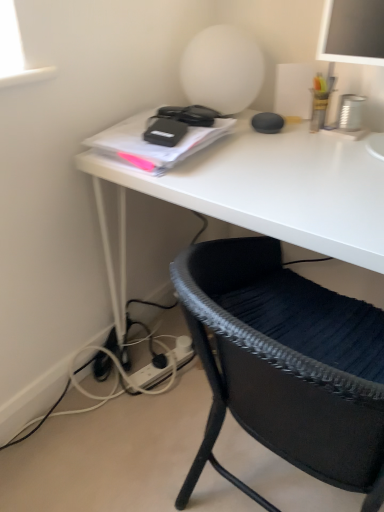
Where is `free spot above black woven chair at lower right (from a real-world perspective)`? free spot above black woven chair at lower right (from a real-world perspective) is located at coordinates (310, 206).